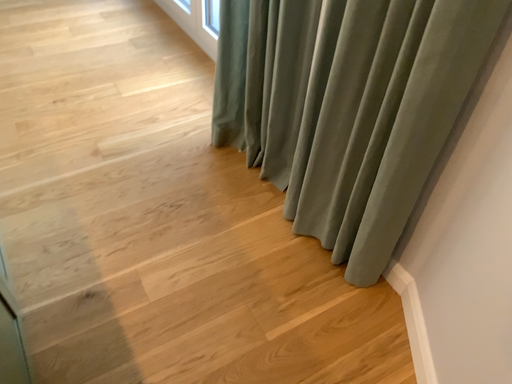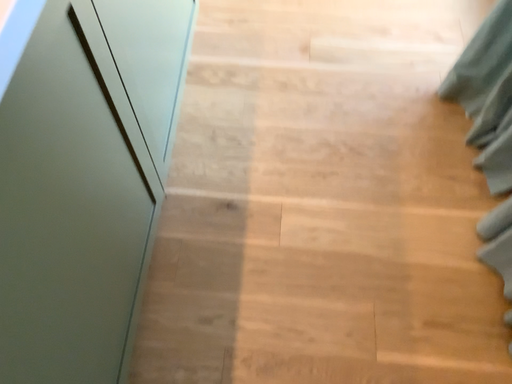
Question: How did the camera likely rotate when shooting the video?

Choices:
 (A) rotated left
 (B) rotated right

Answer: (A)